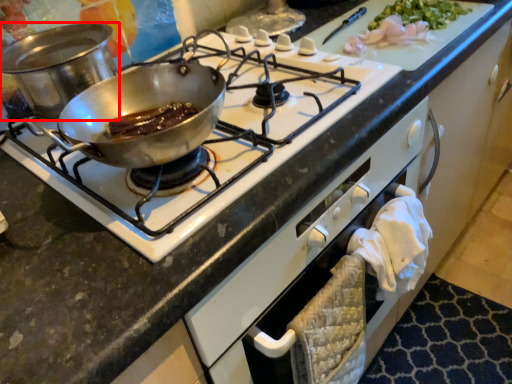
Question: From the image's perspective, where is kitchen appliance (annotated by the red box) located in relation to gas stove in the image?

Choices:
 (A) above
 (B) below

Answer: (A)